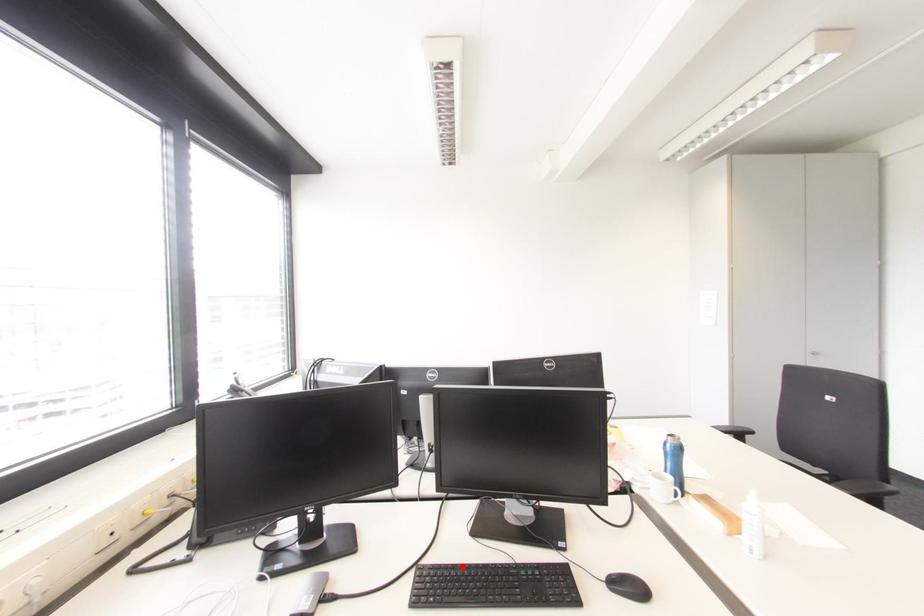
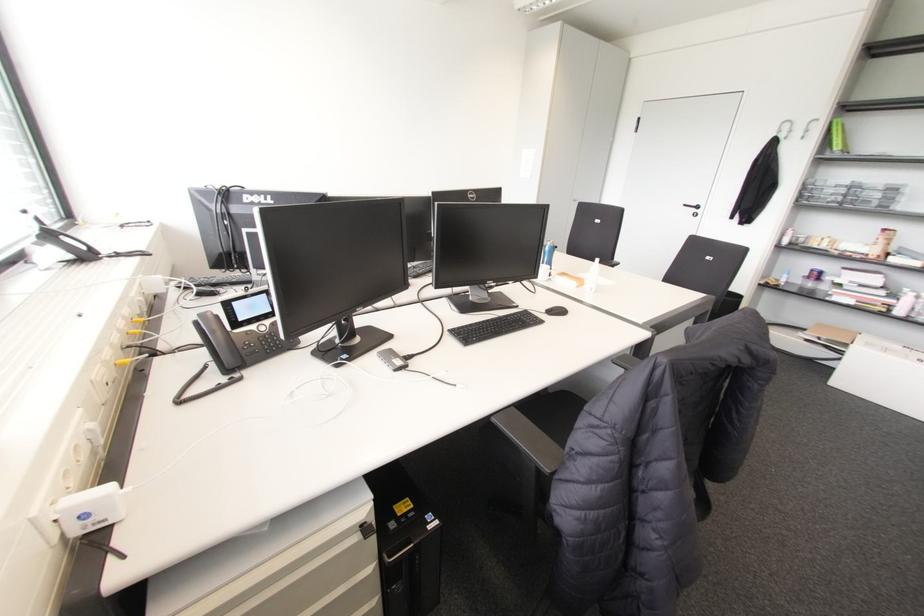
Where in the second image is the point corresponding to the highlighted location from the first image?

(476, 323)